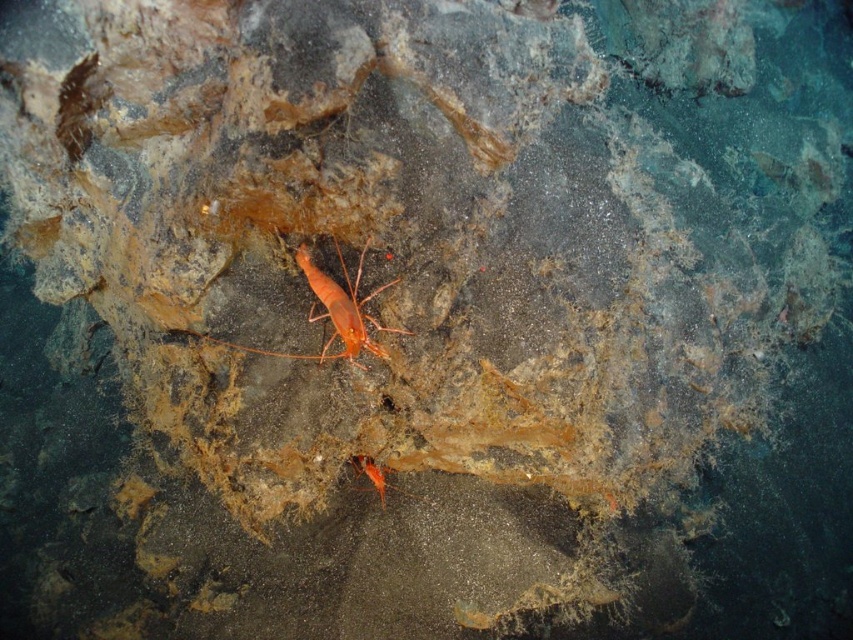
Between point (235, 348) and point (384, 480), which one is positioned behind?

The point (384, 480) is behind.

Between orange matte shrimp at center and orange matte shrimp at lower center, which one is positioned higher?

orange matte shrimp at center is higher up.

Is point (332, 300) closer to viewer compared to point (381, 472)?

Yes, point (332, 300) is in front of point (381, 472).

I want to click on orange matte shrimp at center, so click(329, 310).